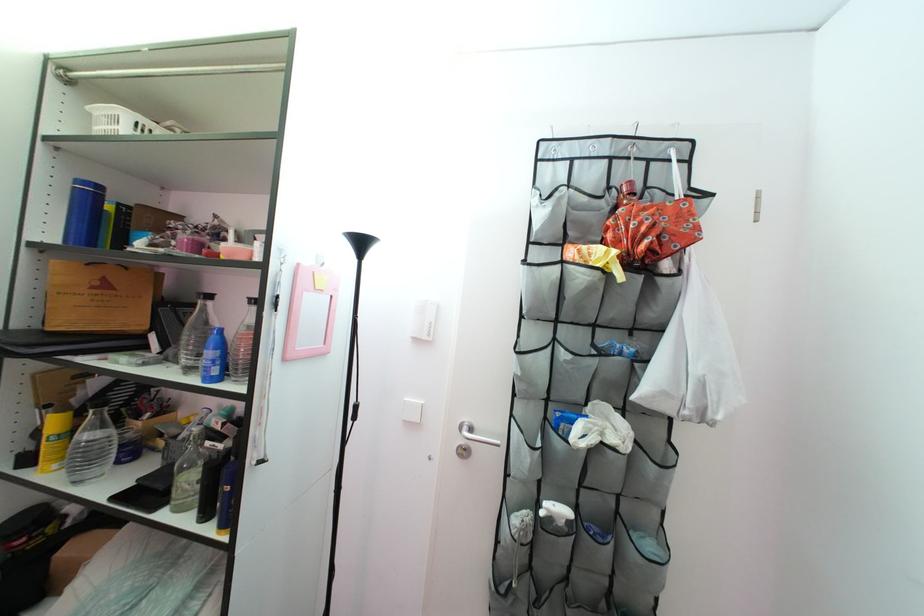
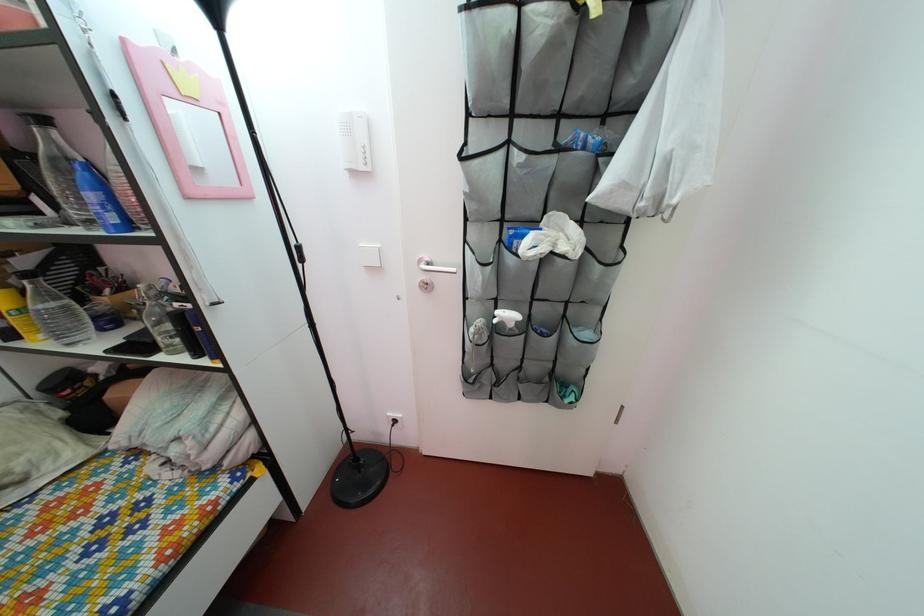
The point at (706, 378) is marked in the first image. Where is the corresponding point in the second image?

(675, 152)